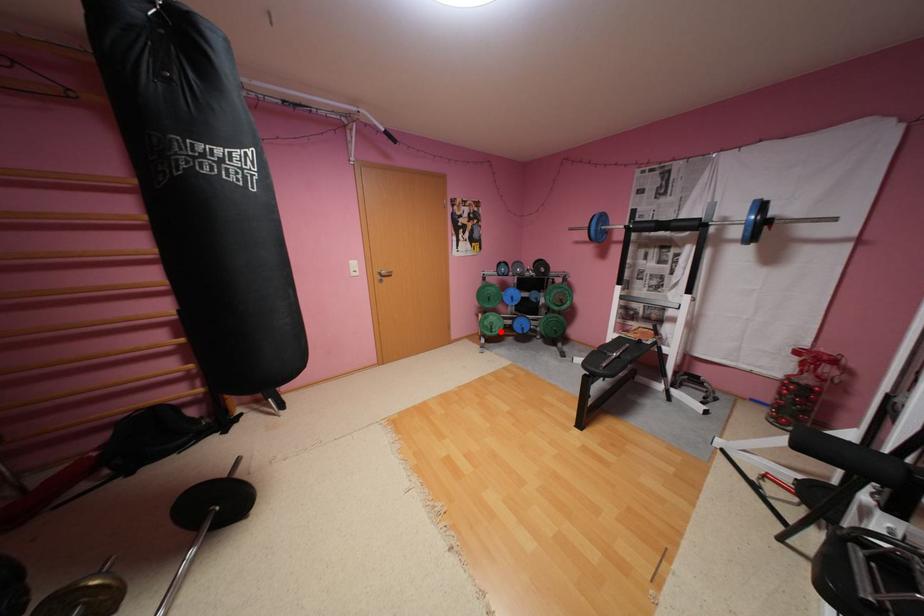
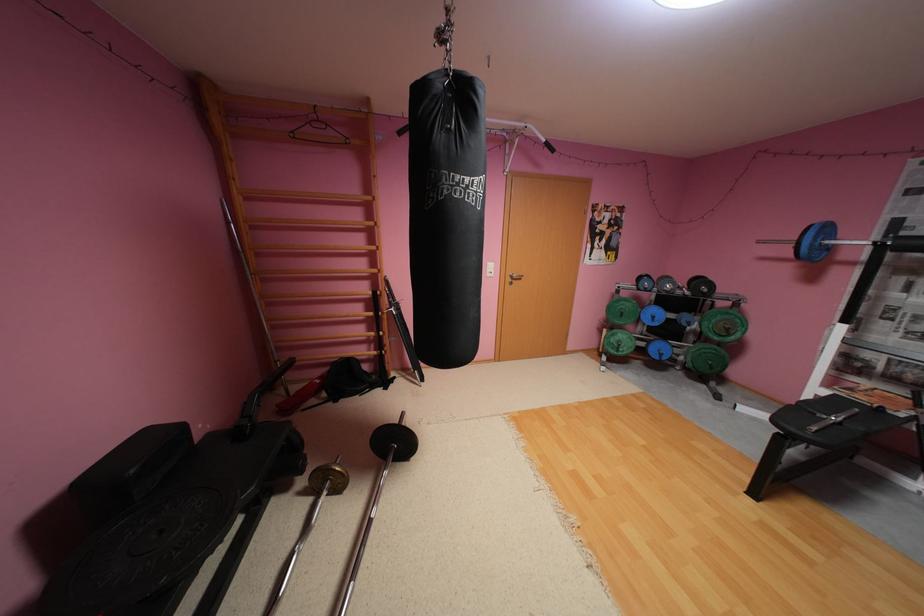
In the second image, find the point that corresponds to the highlighted location in the first image.

(626, 351)